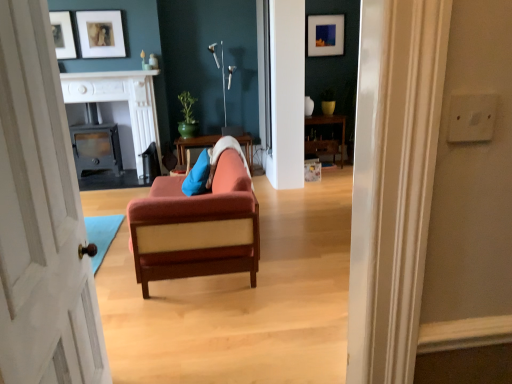
What do you see at coordinates (197, 176) in the screenshot?
I see `blue fabric pillow at center` at bounding box center [197, 176].

Identify the location of blue fabric pillow at center. (197, 176).

In order to face matte black wood stove at center left, the first fireplace positioned from the left, should I rotate leftwards or rightwards?

Turn left approximately 20.694 degrees to face it.

The width and height of the screenshot is (512, 384). What do you see at coordinates (197, 226) in the screenshot?
I see `matte orange couch at center` at bounding box center [197, 226].

The width and height of the screenshot is (512, 384). What do you see at coordinates (101, 34) in the screenshot? I see `matte white picture frame at upper left, the 2th picture frame positioned from the left` at bounding box center [101, 34].

I want to click on blue fabric pillow at center, so click(x=197, y=176).

From the picture: From the image's perspective, does white wooden door at center appear lower than matte orange couch at center?

Correct, white wooden door at center appears lower than matte orange couch at center in the image.

Is white wooden door at center inside or outside of matte orange couch at center?

The correct answer is: outside.

Is white wooden door at center facing towards matte orange couch at center?

No, white wooden door at center is not facing towards matte orange couch at center.

From a real-world perspective, is white wooden door at center above or below matte orange couch at center?

Clearly, from a real-world perspective, white wooden door at center is above matte orange couch at center.

Can you confirm if green glossy pot at upper center is bigger than matte black wood stove at center left, the first fireplace positioned from the left?

No, green glossy pot at upper center is not bigger than matte black wood stove at center left, the first fireplace positioned from the left.

Is green glossy pot at upper center placed right next to matte black wood stove at center left, the first fireplace positioned from the left?

green glossy pot at upper center and matte black wood stove at center left, the first fireplace positioned from the left, are clearly separated.

From a real-world perspective, is green glossy pot at upper center beneath matte black wood stove at center left, the first fireplace positioned from the left?

No.

Could you tell me if wooden dresser at center is turned towards white glossy fireplace at upper center?

No, wooden dresser at center is not aimed at white glossy fireplace at upper center.

Locate an element on the screen. The image size is (512, 384). mantle that is above the wooden dresser at center (from the image's perspective) is located at coordinates (109, 74).

Is wooden dresser at center next to white glossy fireplace at upper center?

No, wooden dresser at center is not making contact with white glossy fireplace at upper center.

Which of these two, wooden dresser at center or white glossy fireplace at upper center, stands shorter?

Standing shorter between the two is white glossy fireplace at upper center.

From a real-world perspective, who is located higher, matte black wood stove at center, arranged as the 2th fireplace when viewed from the left, or white plastic lamp at upper center?

From a 3D spatial view, white plastic lamp at upper center is above.

I want to click on lamp located above the matte black wood stove at center, the 1th fireplace from the right (from a real-world perspective), so click(224, 91).

Considering the positions of point (132, 95) and point (213, 44), is point (132, 95) closer or farther from the camera than point (213, 44)?

Point (132, 95) is closer to the camera than point (213, 44).

Considering the sizes of matte white picture frame at upper left, which is counted as the 2th picture frame, starting from the back, and wooden table at center in the image, is matte white picture frame at upper left, which is counted as the 2th picture frame, starting from the back, wider or thinner than wooden table at center?

Considering their sizes, matte white picture frame at upper left, which is counted as the 2th picture frame, starting from the back, looks slimmer than wooden table at center.

How many degrees apart are the facing directions of matte white picture frame at upper left, marked as the 2th picture frame in a front-to-back arrangement, and wooden table at center?

The angle between the facing direction of matte white picture frame at upper left, marked as the 2th picture frame in a front-to-back arrangement, and the facing direction of wooden table at center is 0.66 degrees.

Would you say matte white picture frame at upper left, the 2th picture frame positioned from the left, is to the left or to the right of wooden table at center in the picture?

In the image, matte white picture frame at upper left, the 2th picture frame positioned from the left, appears on the left side of wooden table at center.

From a real-world perspective, is matte white picture frame at upper left, marked as the 2th picture frame in a front-to-back arrangement, under wooden table at center?

No, from a real-world perspective, matte white picture frame at upper left, marked as the 2th picture frame in a front-to-back arrangement, is not under wooden table at center.

Based on the photo, does matte black wood stove at center, the 1th fireplace from the right, touch green glossy pot at upper center?

No, matte black wood stove at center, the 1th fireplace from the right, is not in contact with green glossy pot at upper center.

Is matte black wood stove at center, the 1th fireplace from the right, taller or shorter than green glossy pot at upper center?

Clearly, matte black wood stove at center, the 1th fireplace from the right, is taller compared to green glossy pot at upper center.

From the image's perspective, which object appears higher, matte black wood stove at center, the 1th fireplace from the right, or green glossy pot at upper center?

green glossy pot at upper center appears higher in the image.

In the scene shown: Is matte black wood stove at center, arranged as the 2th fireplace when viewed from the left, further to camera compared to green glossy pot at upper center?

No, it is in front of green glossy pot at upper center.

Considering the relative sizes of green glossy pot at upper center and wooden table at center in the image provided, is green glossy pot at upper center bigger than wooden table at center?

Actually, green glossy pot at upper center might be smaller than wooden table at center.

Is green glossy pot at upper center at the right side of wooden table at center?

Incorrect, green glossy pot at upper center is not on the right side of wooden table at center.

Measure the distance between green glossy pot at upper center and wooden table at center.

green glossy pot at upper center and wooden table at center are 15.93 inches apart.

Where is `door below the matte orange couch at center (from the image's perspective)`? door below the matte orange couch at center (from the image's perspective) is located at coordinates (41, 217).

At what (x,y) coordinates should I click in order to perform the action: click on the 2nd fireplace directly beneath the green glossy pot at upper center (from a real-world perspective). Please return your answer as a coordinate pair (x, y). Looking at the image, I should click on (96, 148).

Based on the photo, when comparing their distances from matte white picture frame at upper left, the first picture frame positioned from the left, does blue fabric pillow at center or white wooden door at center seem further?

white wooden door at center.

Looking at the image, which one is located further to matte black picture frame at upper center, which appears as the first picture frame when viewed from the back, white glossy fireplace at upper center or matte black wood stove at center left, the first fireplace positioned from the left?

matte black wood stove at center left, the first fireplace positioned from the left.

From the image, which object appears to be farther from white wooden door at center, matte black wood stove at center, the 1th fireplace from the right, or wooden table at center?

wooden table at center.

When comparing their distances from white plastic lamp at upper center, does blue fabric pillow at center or wooden table at center seem further?

Among the two, blue fabric pillow at center is located further to white plastic lamp at upper center.

Estimate the real-world distances between objects in this image. Which object is closer to matte black picture frame at upper center, positioned as the third picture frame in left-to-right order, green glossy pot at upper center or wooden dresser at center?

wooden dresser at center is positioned closer to the anchor matte black picture frame at upper center, positioned as the third picture frame in left-to-right order.

Considering their positions, is matte black picture frame at upper center, marked as the third picture frame in a front-to-back arrangement, positioned further to matte white picture frame at upper left, the 3th picture frame when ordered from right to left, than matte white picture frame at upper left, which is counted as the 2th picture frame, starting from the back?

Based on the image, matte black picture frame at upper center, marked as the third picture frame in a front-to-back arrangement, appears to be further to matte white picture frame at upper left, the 3th picture frame when ordered from right to left.

From the image, which object appears to be farther from white wooden door at center, white glossy vase at center or matte white picture frame at upper left, the 3th picture frame from the back?

white glossy vase at center is positioned further to the anchor white wooden door at center.

Which object lies nearer to the anchor point matte white picture frame at upper left, the second picture frame when ordered from right to left, matte black picture frame at upper center, marked as the third picture frame in a front-to-back arrangement, or white wooden door at center?

Among the two, matte black picture frame at upper center, marked as the third picture frame in a front-to-back arrangement, is located nearer to matte white picture frame at upper left, the second picture frame when ordered from right to left.

Identify the location of pillow located between white wooden door at center and white glossy vase at center in the depth direction. (197, 176).

Locate an element on the screen. vase located between green glossy pot at upper center and wooden dresser at center in the left-right direction is located at coordinates (309, 106).

I want to click on table between matte black wood stove at center, arranged as the 2th fireplace when viewed from the left, and white plastic lamp at upper center, so click(x=193, y=145).

Where is `dresser between matte white picture frame at upper left, the 3th picture frame from the back, and matte black picture frame at upper center, positioned as the third picture frame in left-to-right order`? The height and width of the screenshot is (384, 512). dresser between matte white picture frame at upper left, the 3th picture frame from the back, and matte black picture frame at upper center, positioned as the third picture frame in left-to-right order is located at coordinates (330, 123).